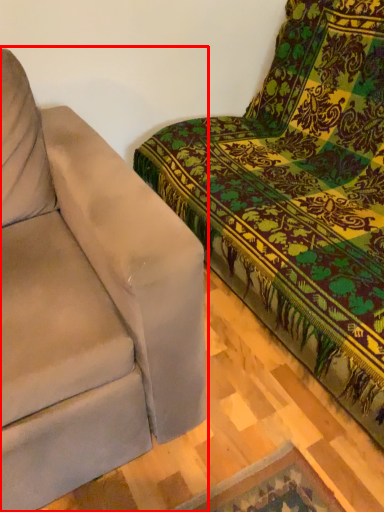
Question: From the image's perspective, what is the correct spatial relationship of studio couch (annotated by the red box) in relation to studio couch?

Choices:
 (A) below
 (B) above

Answer: (A)